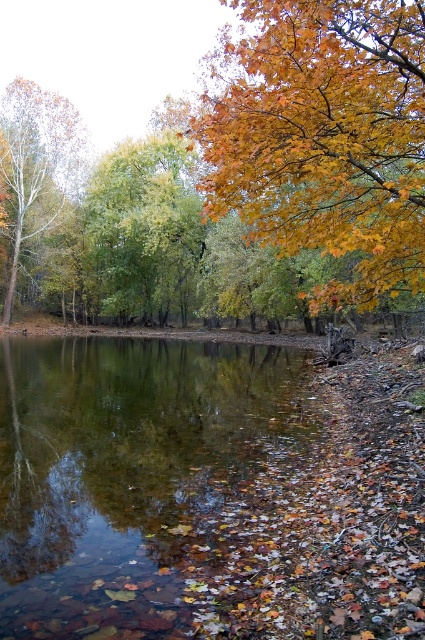
Is clear water at center below smooth white bark tree at left?

Yes.

Is clear water at center bigger than smooth white bark tree at left?

No, clear water at center is not bigger than smooth white bark tree at left.

Where is `clear water at center`? This screenshot has height=640, width=425. clear water at center is located at coordinates (x=146, y=483).

Can you confirm if clear water at center is positioned to the left of green leafy tree at center?

No, clear water at center is not to the left of green leafy tree at center.

Does point (263, 365) lie in front of point (133, 172)?

Yes, it is.

Where is `clear water at center`? clear water at center is located at coordinates (146, 483).

Can you confirm if green leafy tree at center is taller than smooth white bark tree at left?

In fact, green leafy tree at center may be shorter than smooth white bark tree at left.

Does green leafy tree at center have a lesser height compared to smooth white bark tree at left?

Indeed, green leafy tree at center has a lesser height compared to smooth white bark tree at left.

Which is behind, point (183, 177) or point (11, 285)?

The point (183, 177) is behind.

Where is `green leafy tree at center`? The width and height of the screenshot is (425, 640). green leafy tree at center is located at coordinates 142,230.